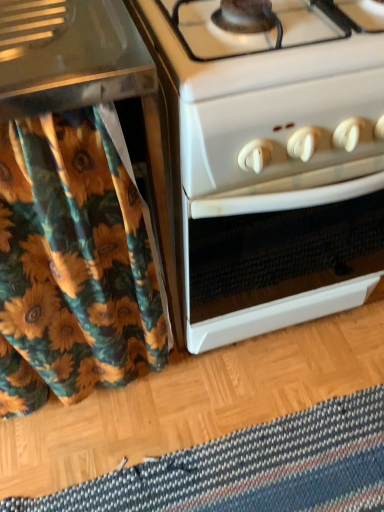
Find the location of a particular element. This screenshot has height=512, width=384. vacant space to the right of floral fabric shower curtain at left is located at coordinates (183, 415).